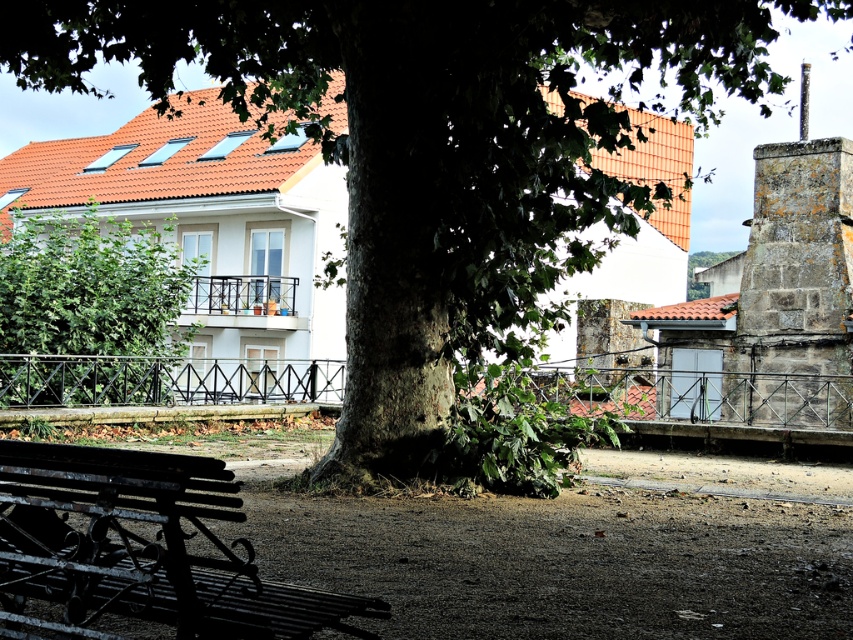
Is rusty metal bench at lower left positioned in front of gray stone chimney at upper right?

Yes, rusty metal bench at lower left is in front of gray stone chimney at upper right.

Who is positioned more to the left, rusty metal bench at lower left or gray stone chimney at upper right?

rusty metal bench at lower left is more to the left.

The width and height of the screenshot is (853, 640). What are the coordinates of `rusty metal bench at lower left` in the screenshot? It's located at (141, 548).

Does green leafy tree at left lie behind gray stone chimney at upper right?

No, it is not.

Can you confirm if green leafy tree at left is positioned above gray stone chimney at upper right?

Yes.

Does point (91, 253) lie in front of point (788, 154)?

Yes.

I want to click on green leafy tree at left, so click(88, 312).

What do you see at coordinates (141, 548) in the screenshot?
I see `rusty metal bench at lower left` at bounding box center [141, 548].

You are a GUI agent. You are given a task and a screenshot of the screen. Output one action in this format:
    pyautogui.click(x=<x>, y=<y>)
    Task: Click on the rusty metal bench at lower left
    
    Given the screenshot: What is the action you would take?
    (141, 548)

The width and height of the screenshot is (853, 640). What are the coordinates of `rusty metal bench at lower left` in the screenshot? It's located at (141, 548).